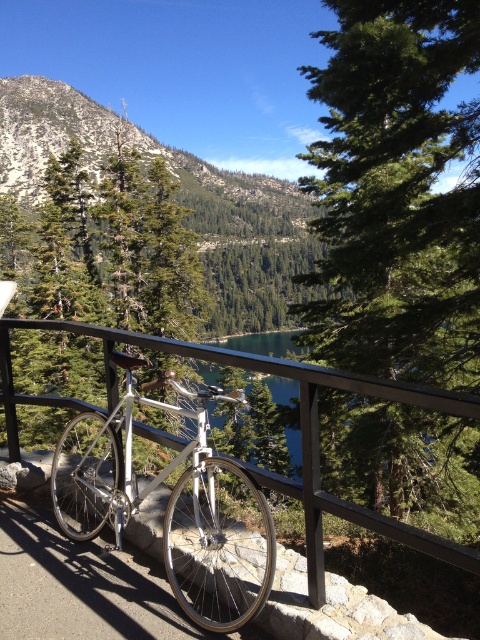
Is silver metallic bicycle at center closer to the viewer compared to black metal fence at center?

That is True.

Between point (230, 538) and point (300, 371), which one is positioned in front?

Point (300, 371) is more forward.

The height and width of the screenshot is (640, 480). What are the coordinates of `silver metallic bicycle at center` in the screenshot? It's located at (172, 506).

Does silver metallic bicycle at center appear over green leafy trees at upper left?

Actually, silver metallic bicycle at center is below green leafy trees at upper left.

Is point (189, 552) in front of point (100, 163)?

That is True.

This screenshot has height=640, width=480. In order to click on silver metallic bicycle at center in this screenshot , I will do `click(172, 506)`.

Is green leafy trees at upper left taller than black metal fence at center?

Yes, green leafy trees at upper left is taller than black metal fence at center.

Is green leafy trees at upper left wider than black metal fence at center?

Correct, the width of green leafy trees at upper left exceeds that of black metal fence at center.

What are the coordinates of `green leafy trees at upper left` in the screenshot? It's located at (143, 157).